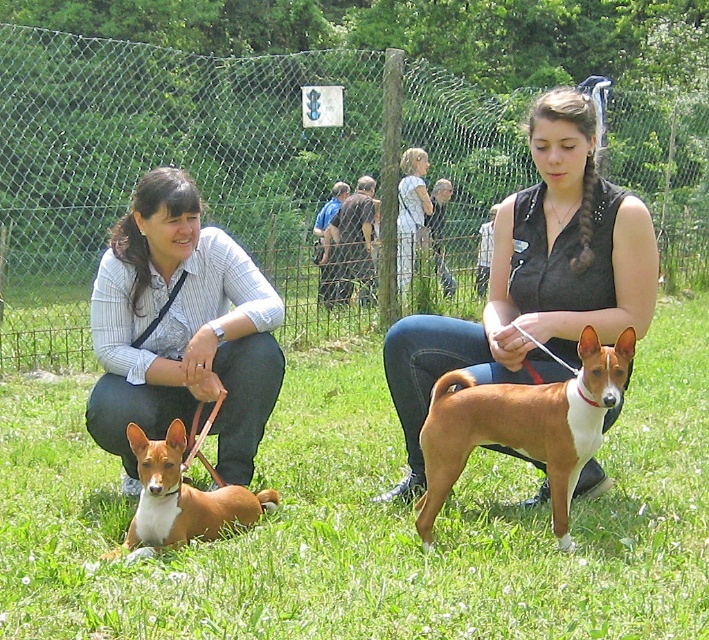
You are standing in the park and want to walk your dog from point A to point B. You see two points marked as point (233, 474) and point (223, 506). Which point should you start at if you want to walk towards the fence that is at the back of the park?

You should start at point (233, 474) because it is behind point (223, 506), meaning it is closer to the fence at the back of the park.

In the scene shown: In the scene described, there are two Basenji dogs and a point marked at coordinates (x=535, y=278). What object is located at that point?

The point at (x=535, y=278) indicates the black sleeveless top at center.

You are standing in the park and want to take a photo of the green grass at lower center and the brown smooth coat dog at center. Which object will appear larger in your photo?

The green grass at lower center will appear larger in the photo because it is closer to the viewer than the brown smooth coat dog at center.